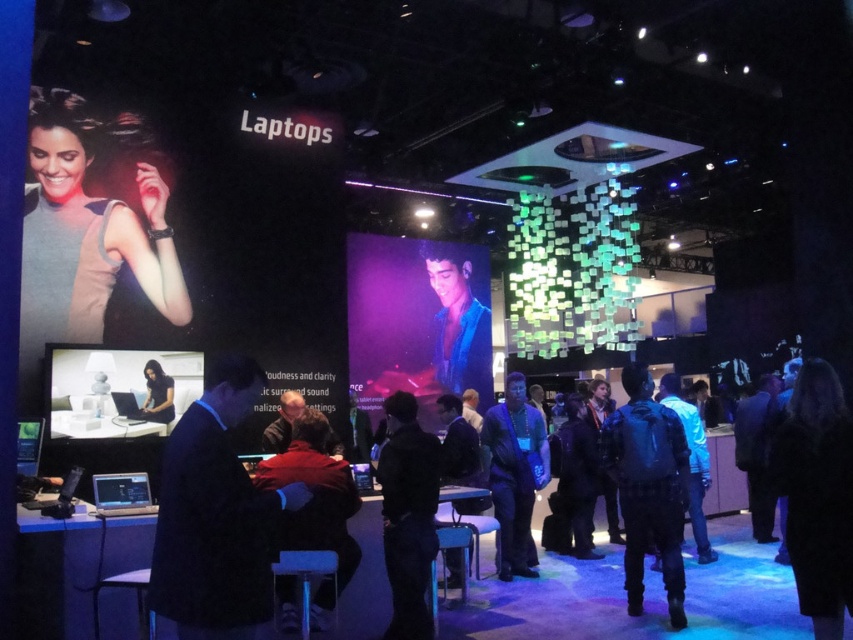
You are an attendee at the tech exhibition and you see both the black matte jacket at center and the dark red jacket at center. Which one is located to the right of the other?

The black matte jacket at center is positioned on the right side of dark red jacket at center.

What is located at the coordinates point (216, 515) in the image?

The dark blue suit at center is located at point (216, 515).

You are an attendee at the tech exhibition. You see a dark blue suit at center and a dark blue backpack at center. Which one is closer to you?

The dark blue suit at center is closer to you because it is in front of the dark blue backpack at center.